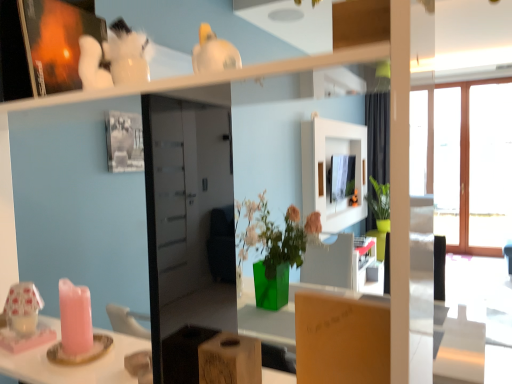
Question: Is matte brown cardboard box at center, the second cardboard box viewed from the left, turned away from wooden frame at right?

Choices:
 (A) yes
 (B) no

Answer: (B)

Question: Is the position of matte brown cardboard box at center, the first cardboard box from the right, less distant than that of wooden frame at right?

Choices:
 (A) no
 (B) yes

Answer: (B)

Question: From the image's perspective, is matte brown cardboard box at center, the second cardboard box viewed from the left, located beneath wooden frame at right?

Choices:
 (A) yes
 (B) no

Answer: (A)

Question: Can you see matte brown cardboard box at center, the first cardboard box from the right, touching wooden frame at right?

Choices:
 (A) yes
 (B) no

Answer: (B)

Question: Can you confirm if matte brown cardboard box at center, the second cardboard box viewed from the left, is bigger than wooden frame at right?

Choices:
 (A) no
 (B) yes

Answer: (A)

Question: Is matte brown cardboard box at center, the second cardboard box viewed from the left, thinner than wooden frame at right?

Choices:
 (A) no
 (B) yes

Answer: (B)

Question: Is wooden frame at right not inside wooden block at center, the first cardboard box from the left?

Choices:
 (A) yes
 (B) no

Answer: (A)

Question: From a real-world perspective, is wooden frame at right over wooden block at center, which is the second cardboard box in right-to-left order?

Choices:
 (A) no
 (B) yes

Answer: (B)

Question: Does wooden frame at right lie behind wooden block at center, the first cardboard box from the left?

Choices:
 (A) no
 (B) yes

Answer: (B)

Question: Is wooden block at center, the first cardboard box from the left, at the back of wooden frame at right?

Choices:
 (A) no
 (B) yes

Answer: (A)

Question: From the image's perspective, does wooden frame at right appear lower than wooden block at center, the first cardboard box from the left?

Choices:
 (A) yes
 (B) no

Answer: (B)

Question: Can you confirm if wooden frame at right is wider than wooden block at center, which is the second cardboard box in right-to-left order?

Choices:
 (A) yes
 (B) no

Answer: (B)

Question: Is wooden frame at right positioned in front of matte brown cardboard box at center, the first cardboard box from the right?

Choices:
 (A) no
 (B) yes

Answer: (A)